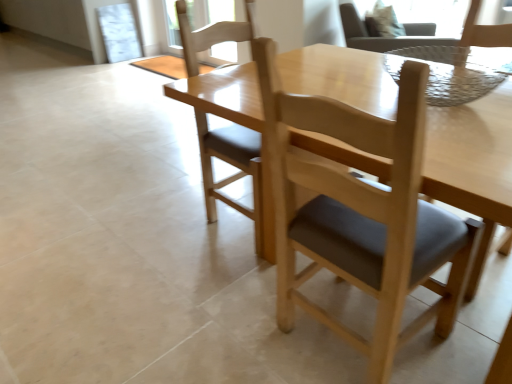
Question: Is light brown wood chair at upper right, the first chair from the right, surrounded by light brown wood chair at upper right, marked as the 3th chair in a front-to-back arrangement?

Choices:
 (A) yes
 (B) no

Answer: (B)

Question: Is light brown wood chair at upper right, the first chair from the right, at the back of light brown wood chair at upper right, marked as the 3th chair in a front-to-back arrangement?

Choices:
 (A) yes
 (B) no

Answer: (B)

Question: Does light brown wood chair at upper right, marked as the 3th chair in a front-to-back arrangement, touch light brown wood chair at upper right, which appears as the 4th chair when viewed from the left?

Choices:
 (A) no
 (B) yes

Answer: (A)

Question: Is light brown wood chair at upper right, the 3th chair when ordered from bottom to top, smaller than light brown wood chair at upper right, the first chair from the right?

Choices:
 (A) yes
 (B) no

Answer: (A)

Question: Considering the relative sizes of light brown wood chair at upper right, the 3th chair when ordered from left to right, and light brown wood chair at upper right, the first chair from the right, in the image provided, is light brown wood chair at upper right, the 3th chair when ordered from left to right, taller than light brown wood chair at upper right, the first chair from the right,?

Choices:
 (A) no
 (B) yes

Answer: (A)

Question: From a real-world perspective, is light brown wood chair at upper right, the 2th chair positioned from the back, over light brown wood chair at upper right, acting as the first chair starting from the top?

Choices:
 (A) yes
 (B) no

Answer: (A)

Question: Is light brown wood chair at upper right, the first chair from the right, outside light brown wood chair at upper right, the 2th chair positioned from the back?

Choices:
 (A) no
 (B) yes

Answer: (B)

Question: Is light brown wood chair at upper right, the 3th chair when ordered from bottom to top, surrounded by light brown wood chair at upper right, acting as the first chair starting from the top?

Choices:
 (A) no
 (B) yes

Answer: (A)

Question: Is light brown wood chair at upper right, the second chair viewed from the top, at the back of light brown wood chair at upper right, arranged as the first chair when viewed from the back?

Choices:
 (A) no
 (B) yes

Answer: (A)

Question: Is light brown wood chair at upper right, placed as the 4th chair when sorted from front to back, to the right of light brown wood chair at upper right, the 3th chair when ordered from left to right, from the viewer's perspective?

Choices:
 (A) no
 (B) yes

Answer: (B)

Question: Can you confirm if light brown wood chair at upper right, arranged as the first chair when viewed from the back, is bigger than light brown wood chair at upper right, the second chair viewed from the top?

Choices:
 (A) no
 (B) yes

Answer: (B)

Question: Considering the relative sizes of light brown wood chair at upper right, placed as the 4th chair when sorted from front to back, and light brown wood chair at upper right, the 3th chair when ordered from bottom to top, in the image provided, is light brown wood chair at upper right, placed as the 4th chair when sorted from front to back, thinner than light brown wood chair at upper right, the 3th chair when ordered from bottom to top,?

Choices:
 (A) no
 (B) yes

Answer: (A)

Question: Is light brown wood chair at center, which is counted as the 3th chair, starting from the top, further to camera compared to light brown wood chair at center, placed as the 2th chair when sorted from left to right?

Choices:
 (A) yes
 (B) no

Answer: (A)